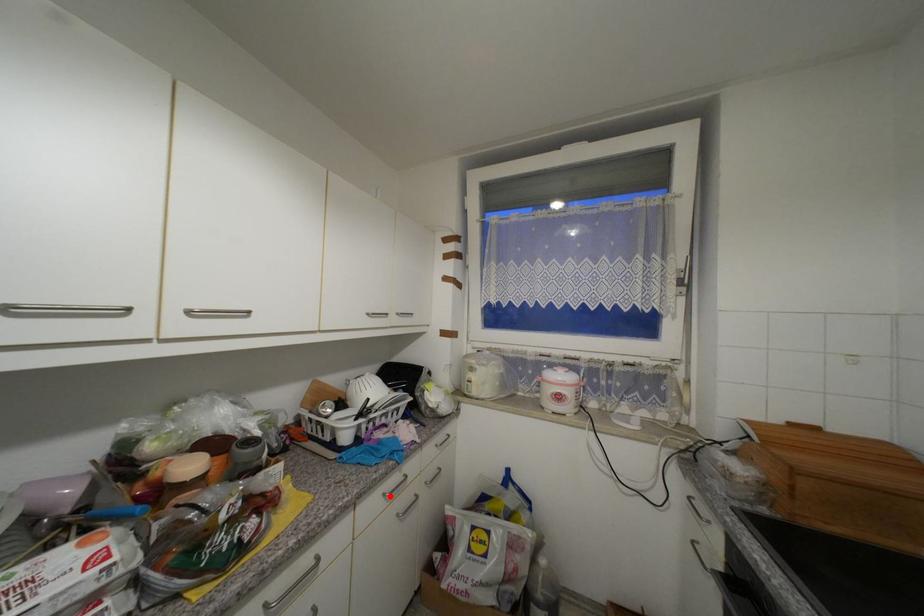
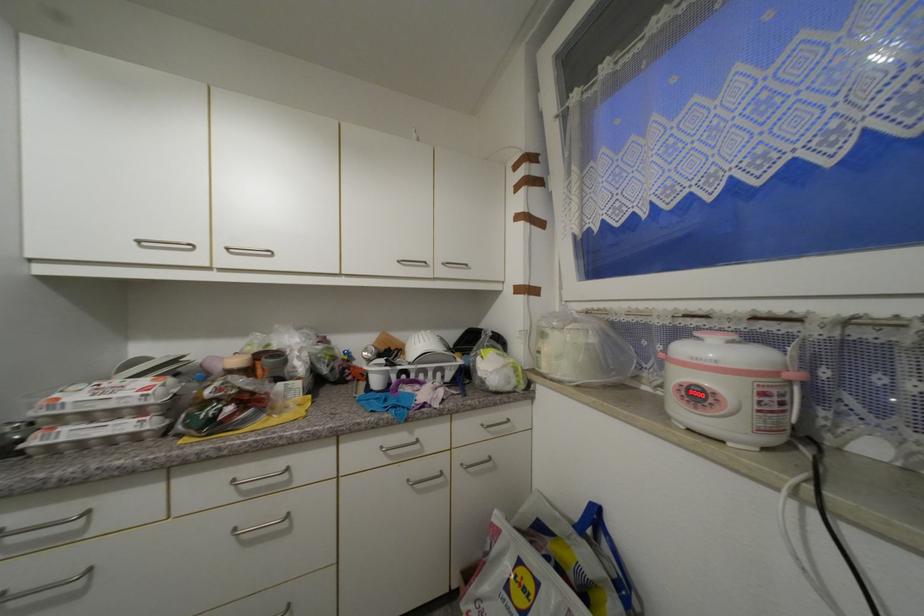
In the second image, find the point that corresponds to the highlighted location in the first image.

(387, 448)